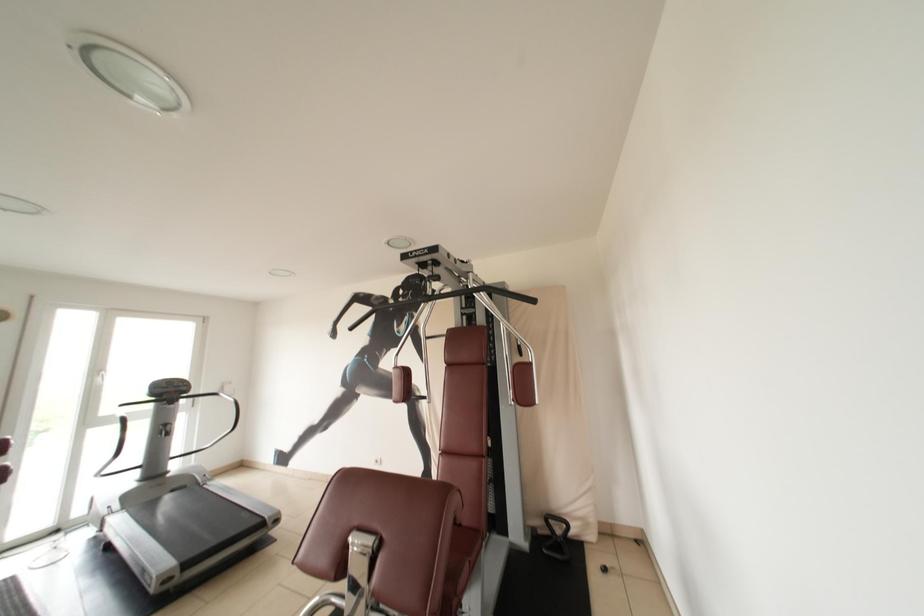
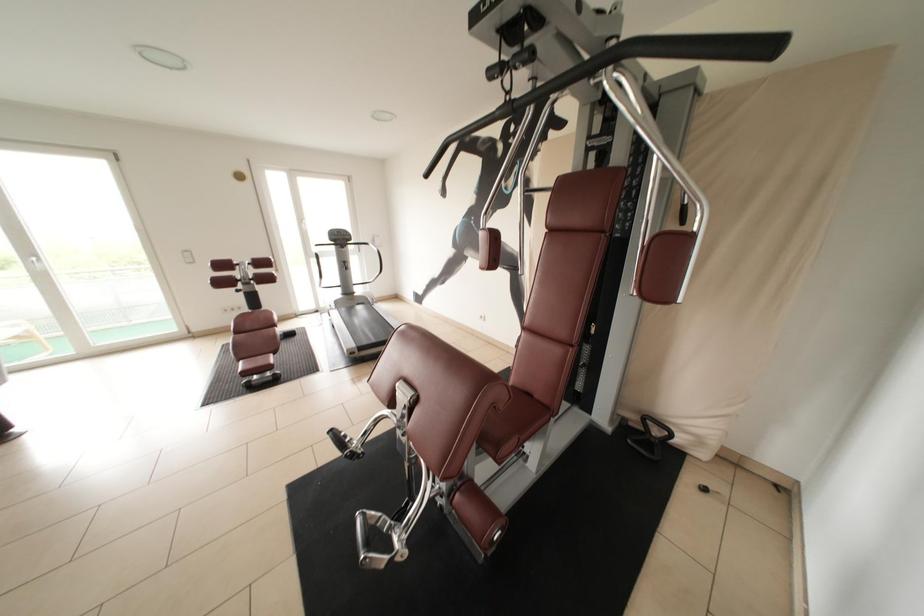
Based on the continuous images, in which direction is the camera rotating?

The camera rotated toward left-down.